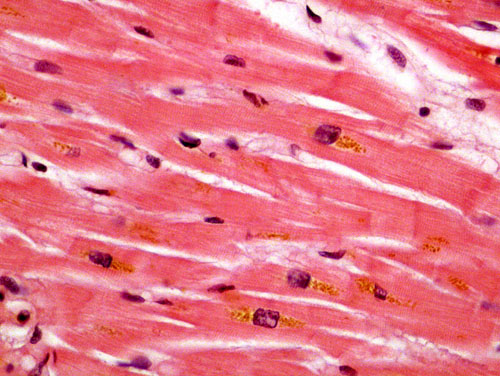
Where is `tissue`? The height and width of the screenshot is (376, 500). tissue is located at coordinates (263, 211).